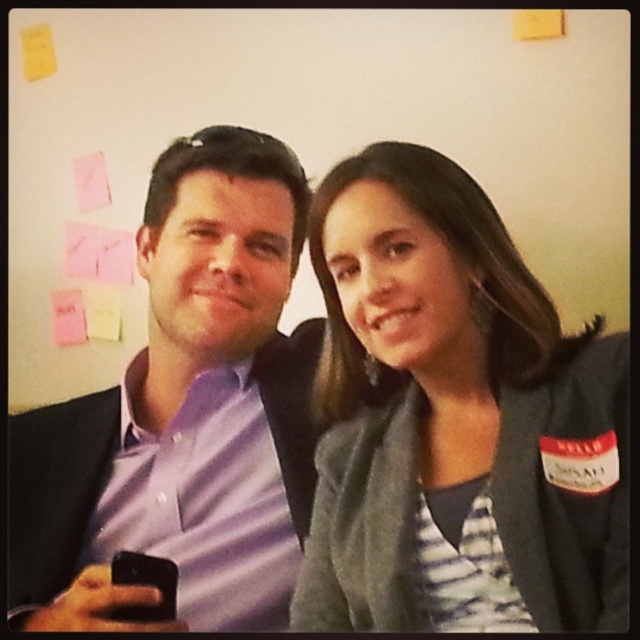
I want to click on gray fabric jacket at upper right, so click(x=456, y=420).

Can you confirm if gray fabric jacket at upper right is smaller than purple shirt at center?

Indeed, gray fabric jacket at upper right has a smaller size compared to purple shirt at center.

The image size is (640, 640). In order to click on gray fabric jacket at upper right in this screenshot , I will do `click(456, 420)`.